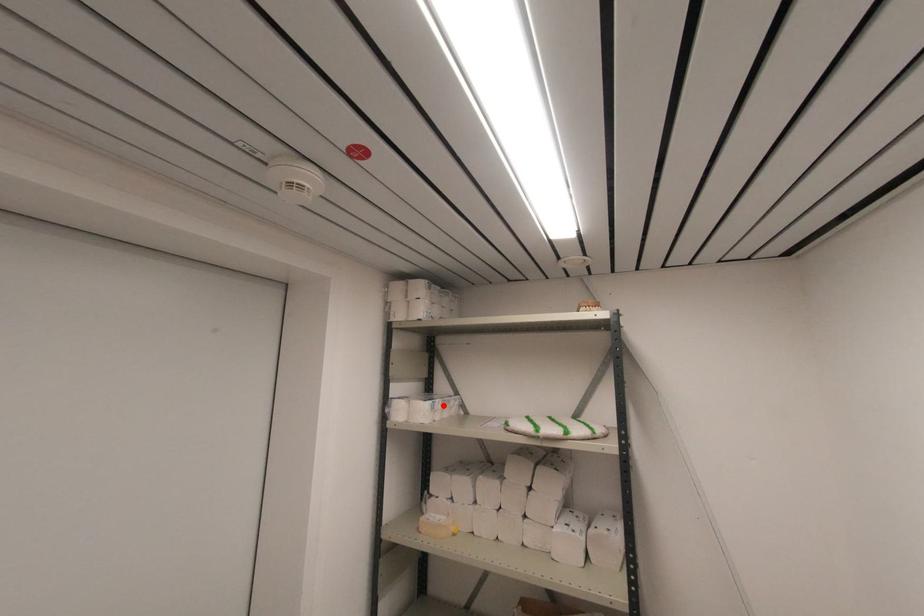
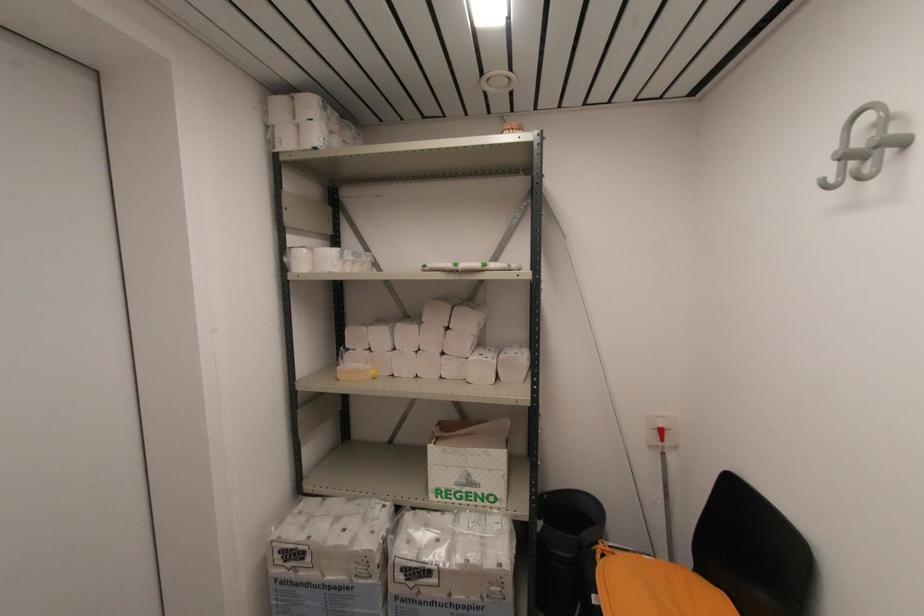
The point at the highlighted location is marked in the first image. Where is the corresponding point in the second image?

(353, 257)